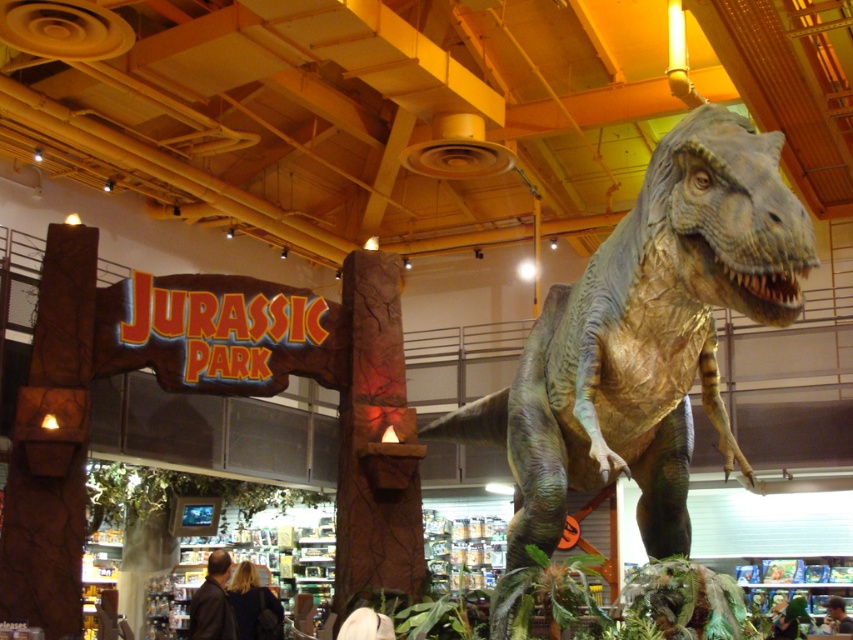
Question: Does green textured dinosaur at center appear on the left side of brown cracked stone at center?

Choices:
 (A) no
 (B) yes

Answer: (A)

Question: Among these points, which one is nearest to the camera?

Choices:
 (A) (688, 371)
 (B) (345, 552)

Answer: (A)

Question: Which point is farther from the camera taking this photo?

Choices:
 (A) (706, 168)
 (B) (422, 576)

Answer: (B)

Question: Does green textured dinosaur at center have a lesser width compared to brown cracked stone at center?

Choices:
 (A) yes
 (B) no

Answer: (B)

Question: Does green textured dinosaur at center appear on the left side of brown cracked stone at center?

Choices:
 (A) no
 (B) yes

Answer: (A)

Question: Which point is closer to the camera taking this photo?

Choices:
 (A) (509, 541)
 (B) (347, 451)

Answer: (A)